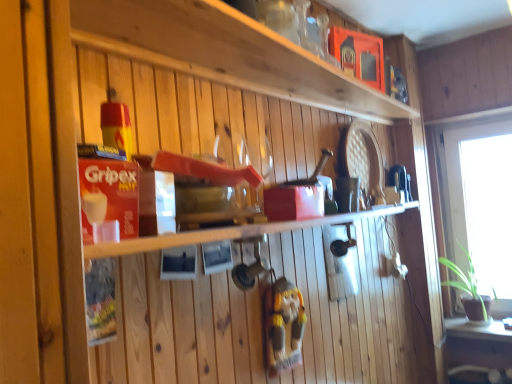
Question: Is green matte table at lower right to the left of wooden gnome at center from the viewer's perspective?

Choices:
 (A) yes
 (B) no

Answer: (B)

Question: Can you confirm if green matte table at lower right is positioned to the right of wooden gnome at center?

Choices:
 (A) yes
 (B) no

Answer: (A)

Question: Can you confirm if green matte table at lower right is taller than wooden gnome at center?

Choices:
 (A) yes
 (B) no

Answer: (B)

Question: Does green matte table at lower right have a lesser height compared to wooden gnome at center?

Choices:
 (A) no
 (B) yes

Answer: (B)

Question: From the image's perspective, is green matte table at lower right located above wooden gnome at center?

Choices:
 (A) yes
 (B) no

Answer: (B)

Question: Is wooden gnome at center situated inside matte wooden shelf at upper center, acting as the 1th shelf starting from the top, or outside?

Choices:
 (A) inside
 (B) outside

Answer: (B)

Question: Considering their positions, is wooden gnome at center located in front of or behind matte wooden shelf at upper center, which is the second shelf in bottom-to-top order?

Choices:
 (A) behind
 (B) front

Answer: (A)

Question: Is wooden gnome at center to the left or to the right of matte wooden shelf at upper center, acting as the 1th shelf starting from the top, in the image?

Choices:
 (A) right
 (B) left

Answer: (B)

Question: Considering the positions of wooden gnome at center and matte wooden shelf at upper center, which is the second shelf in bottom-to-top order, in the image, is wooden gnome at center wider or thinner than matte wooden shelf at upper center, which is the second shelf in bottom-to-top order,?

Choices:
 (A) thin
 (B) wide

Answer: (A)

Question: In terms of height, does wooden gnome at center look taller or shorter compared to transparent glass window at right?

Choices:
 (A) tall
 (B) short

Answer: (B)

Question: In terms of width, does wooden gnome at center look wider or thinner when compared to transparent glass window at right?

Choices:
 (A) wide
 (B) thin

Answer: (A)

Question: Visually, is wooden gnome at center positioned to the left or to the right of transparent glass window at right?

Choices:
 (A) right
 (B) left

Answer: (B)

Question: From a real-world perspective, is wooden gnome at center positioned above or below transparent glass window at right?

Choices:
 (A) below
 (B) above

Answer: (A)

Question: From the image's perspective, relative to green matte table at lower right, is transparent glass window at right above or below?

Choices:
 (A) below
 (B) above

Answer: (B)

Question: Is transparent glass window at right situated inside green matte table at lower right or outside?

Choices:
 (A) inside
 (B) outside

Answer: (B)